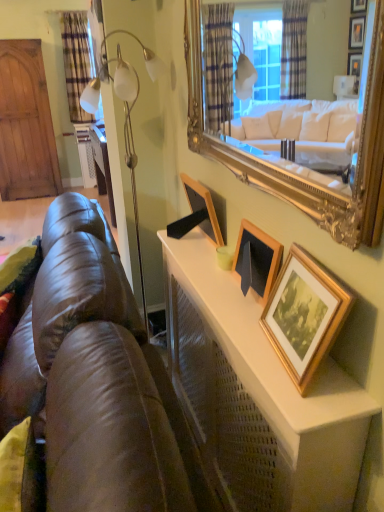
Question: From a real-world perspective, is gold wooden picture frame at upper right, the third picture frame positioned from the left, below wooden picture frame at upper center, which is counted as the third picture frame, starting from the right?

Choices:
 (A) no
 (B) yes

Answer: (B)

Question: Can you confirm if gold wooden picture frame at upper right, the first picture frame in the right-to-left sequence, is smaller than wooden picture frame at upper center, which is counted as the third picture frame, starting from the front?

Choices:
 (A) yes
 (B) no

Answer: (A)

Question: Are gold wooden picture frame at upper right, the first picture frame in the right-to-left sequence, and wooden picture frame at upper center, which ranks as the 1th picture frame in left-to-right order, located far from each other?

Choices:
 (A) yes
 (B) no

Answer: (B)

Question: Considering the relative positions of gold wooden picture frame at upper right, which is the third picture frame from back to front, and wooden picture frame at upper center, which is counted as the third picture frame, starting from the front, in the image provided, is gold wooden picture frame at upper right, which is the third picture frame from back to front, to the left of wooden picture frame at upper center, which is counted as the third picture frame, starting from the front, from the viewer's perspective?

Choices:
 (A) no
 (B) yes

Answer: (A)

Question: From the image's perspective, is gold wooden picture frame at upper right, the first picture frame in the right-to-left sequence, on top of wooden picture frame at upper center, which is counted as the third picture frame, starting from the right?

Choices:
 (A) yes
 (B) no

Answer: (B)

Question: Is gold wooden picture frame at upper right, which is the third picture frame from back to front, oriented away from wooden picture frame at upper center, which ranks as the 1th picture frame in left-to-right order?

Choices:
 (A) yes
 (B) no

Answer: (B)

Question: From the image's perspective, is gold wooden picture frame at upper right, which is the third picture frame from back to front, on top of plaid fabric curtain at upper left?

Choices:
 (A) yes
 (B) no

Answer: (B)

Question: Does gold wooden picture frame at upper right, the third picture frame positioned from the left, have a larger size compared to plaid fabric curtain at upper left?

Choices:
 (A) no
 (B) yes

Answer: (A)

Question: Is plaid fabric curtain at upper left surrounded by gold wooden picture frame at upper right, which appears as the 1th picture frame when viewed from the front?

Choices:
 (A) no
 (B) yes

Answer: (A)

Question: Is gold wooden picture frame at upper right, which appears as the 1th picture frame when viewed from the front, facing towards plaid fabric curtain at upper left?

Choices:
 (A) no
 (B) yes

Answer: (A)

Question: Is gold wooden picture frame at upper right, which is the third picture frame from back to front, closer to camera compared to plaid fabric curtain at upper left?

Choices:
 (A) yes
 (B) no

Answer: (A)

Question: Is the depth of gold wooden picture frame at upper right, the third picture frame positioned from the left, greater than that of plaid fabric curtain at upper left?

Choices:
 (A) no
 (B) yes

Answer: (A)

Question: Is gold wooden picture frame at upper right, which is the third picture frame from back to front, oriented away from brown leather couch at lower left?

Choices:
 (A) yes
 (B) no

Answer: (B)